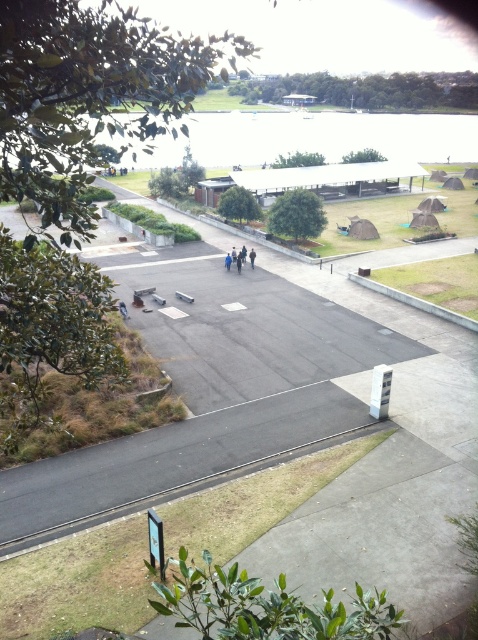
Is clear water at upper center closer to camera compared to brown fabric person at center?

No, clear water at upper center is further to the viewer.

Which is in front, point (198, 115) or point (253, 257)?

Point (253, 257)

The height and width of the screenshot is (640, 478). I want to click on clear water at upper center, so click(x=314, y=138).

Is point (304, 348) positioned after point (253, 253)?

No.

Which is more to the left, asphalt pavement at center or brown fabric person at center?

Positioned to the left is brown fabric person at center.

The image size is (478, 640). What do you see at coordinates (286, 429) in the screenshot? I see `asphalt pavement at center` at bounding box center [286, 429].

This screenshot has width=478, height=640. In order to click on asphalt pavement at center in this screenshot , I will do `click(286, 429)`.

Is asphalt pavement at center above clear water at upper center?

No, asphalt pavement at center is not above clear water at upper center.

Is asphalt pavement at center wider than clear water at upper center?

In fact, asphalt pavement at center might be narrower than clear water at upper center.

Does point (341, 435) lie in front of point (220, 129)?

Yes, it is in front of point (220, 129).

In order to click on asphalt pavement at center in this screenshot , I will do `click(286, 429)`.